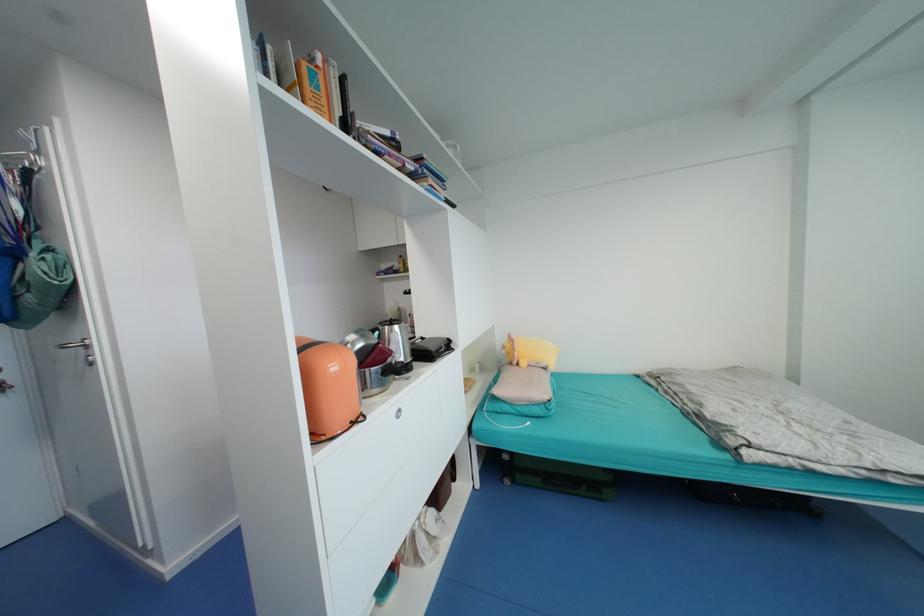
Find where to pull the cabinet drawer pull. Please return your answer as a coordinate pair (x, y).

(397, 411)